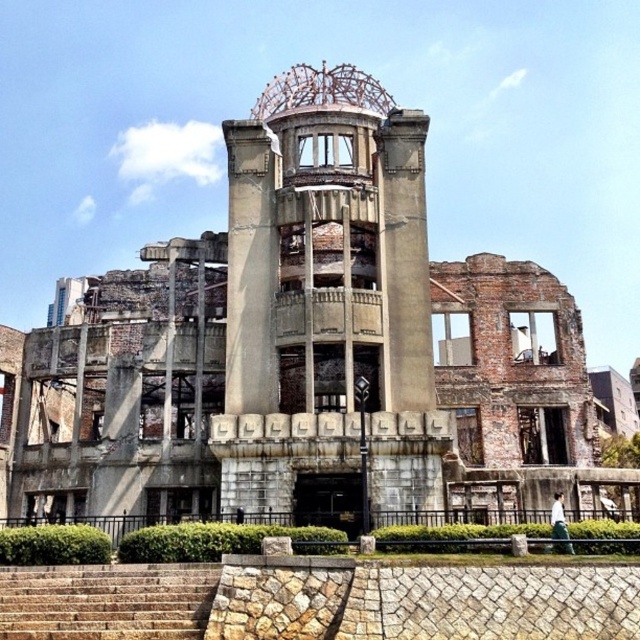
You are a tourist standing in front of the Atomic Bomb Dome. You notice two points on the structure labeled as point 1 at coordinates [259,493] and point 2 at coordinates [202,580]. Which point is closer to your viewpoint?

Point 1 at coordinates [259,493] is closer to your viewpoint because it is further to the camera than point 2 at coordinates [202,580].

You are standing at the entrance of the Atomic Bomb Dome in Hiroshima. You want to locate the brown stone stairs at lower left. According to the coordinates provided, where exactly should you look?

The brown stone stairs at lower left are located at point [106,602].